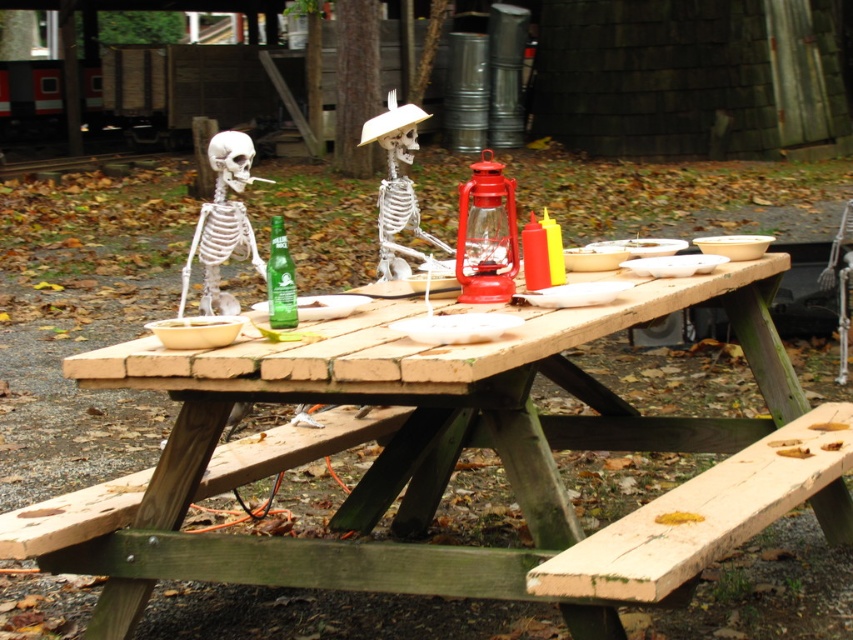
Measure the distance from wooden picnic table at center to white matte skeleton at center.

wooden picnic table at center is 31.60 inches away from white matte skeleton at center.

Does point (782, 356) lie in front of point (380, 220)?

Yes.

The image size is (853, 640). I want to click on wooden picnic table at center, so click(427, 458).

Does wooden picnic table at center appear over green glass bottle at center?

No.

Between point (216, 560) and point (271, 236), which one is positioned in front?

Positioned in front is point (216, 560).

Identify the location of wooden picnic table at center. (427, 458).

Does wooden picnic table at center appear over white bone skeleton at left?

No, wooden picnic table at center is not above white bone skeleton at left.

Is wooden picnic table at center wider than white bone skeleton at left?

Correct, the width of wooden picnic table at center exceeds that of white bone skeleton at left.

Who is more forward, (606, 324) or (215, 192)?

Point (606, 324)

You are a GUI agent. You are given a task and a screenshot of the screen. Output one action in this format:
    pyautogui.click(x=<x>, y=<y>)
    Task: Click on the wooden picnic table at center
    The image size is (853, 640).
    Given the screenshot: What is the action you would take?
    pos(427,458)